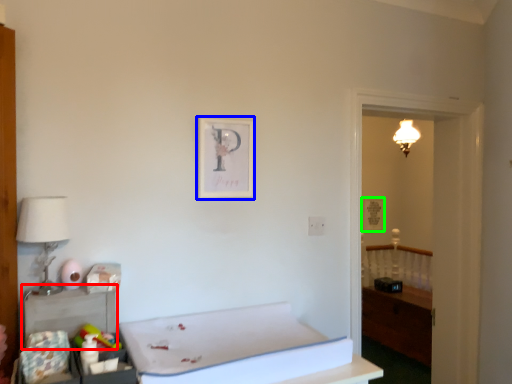
Question: Which is nearer to the table (highlighted by a red box)? picture frame (highlighted by a blue box) or picture frame (highlighted by a green box).

Choices:
 (A) picture frame
 (B) picture frame

Answer: (A)